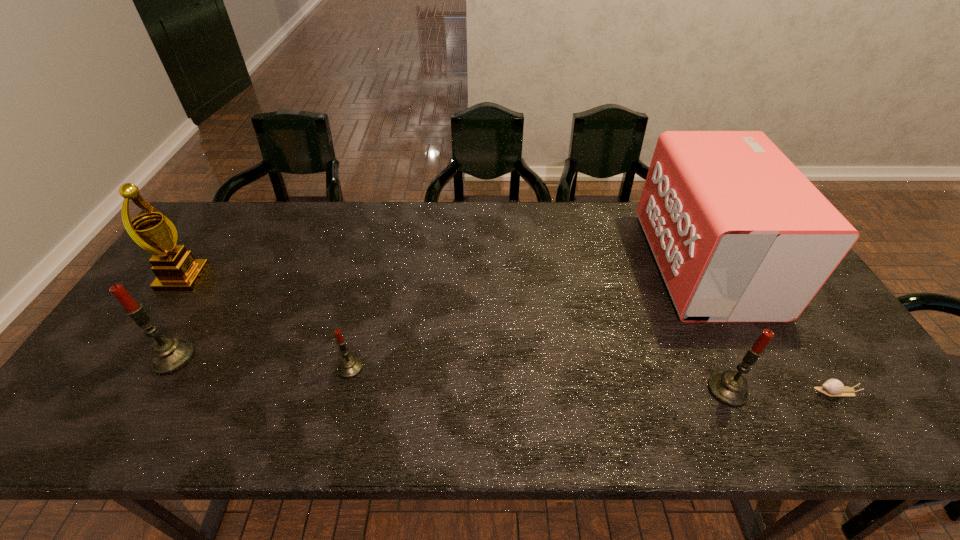
Locate an element on the screen. candle located in the left edge section of the desktop is located at coordinates (168, 354).

Where is `award present at the left edge`? The width and height of the screenshot is (960, 540). award present at the left edge is located at coordinates (176, 269).

Locate an element on the screen. box that is at the right edge is located at coordinates (739, 234).

I want to click on escargot positioned at the right edge, so click(832, 387).

Locate an element on the screen. The width and height of the screenshot is (960, 540). object present at the near left corner is located at coordinates (168, 354).

This screenshot has height=540, width=960. I want to click on object positioned at the far right corner, so click(739, 234).

Image resolution: width=960 pixels, height=540 pixels. I want to click on object at the near right corner, so click(x=832, y=387).

Identify the location of vacant space at the far edge. (451, 224).

Where is `free space at the near edge of the desktop`? The image size is (960, 540). free space at the near edge of the desktop is located at coordinates point(457,376).

Find the location of a particular element. blank space at the left edge of the desktop is located at coordinates (204, 259).